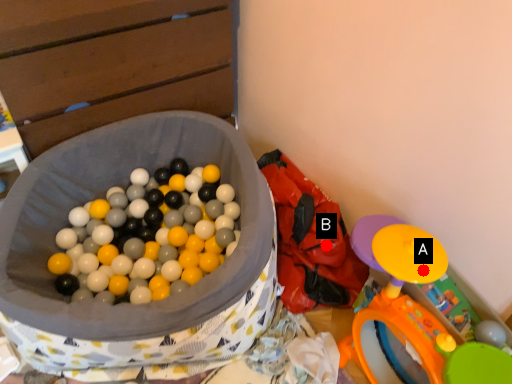
Question: Two points are circled on the image, labeled by A and B beside each circle. Which point is closer to the camera taking this photo?

Choices:
 (A) A is closer
 (B) B is closer

Answer: (A)